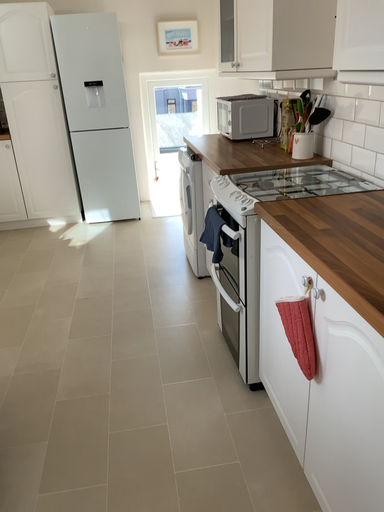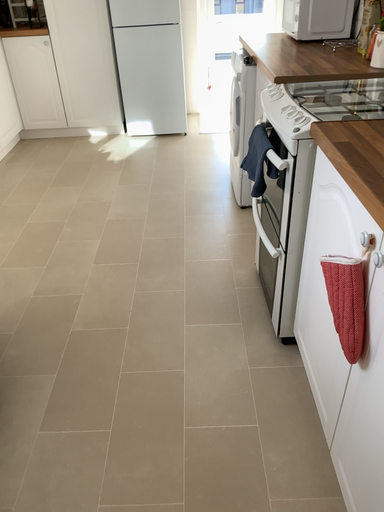
Question: Which way did the camera rotate in the video?

Choices:
 (A) rotated upward
 (B) rotated downward

Answer: (B)